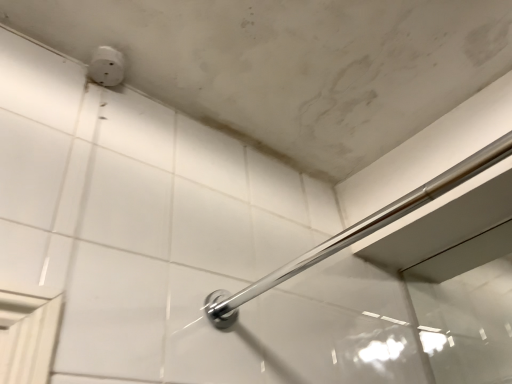
Question: Is polished chrome bar at upper center spatially inside white plastic outlet at upper left, or outside of it?

Choices:
 (A) inside
 (B) outside

Answer: (B)

Question: In terms of height, does polished chrome bar at upper center look taller or shorter compared to white plastic outlet at upper left?

Choices:
 (A) short
 (B) tall

Answer: (B)

Question: Does point (347, 228) appear closer or farther from the camera than point (109, 59)?

Choices:
 (A) farther
 (B) closer

Answer: (A)

Question: Looking at the image, does white plastic outlet at upper left seem bigger or smaller compared to polished chrome bar at upper center?

Choices:
 (A) big
 (B) small

Answer: (B)

Question: Considering the positions of point (113, 57) and point (494, 142), is point (113, 57) closer or farther from the camera than point (494, 142)?

Choices:
 (A) closer
 (B) farther

Answer: (A)

Question: From a real-world perspective, is white plastic outlet at upper left physically located above or below polished chrome bar at upper center?

Choices:
 (A) above
 (B) below

Answer: (A)

Question: Considering the positions of white plastic outlet at upper left and polished chrome bar at upper center in the image, is white plastic outlet at upper left wider or thinner than polished chrome bar at upper center?

Choices:
 (A) wide
 (B) thin

Answer: (B)